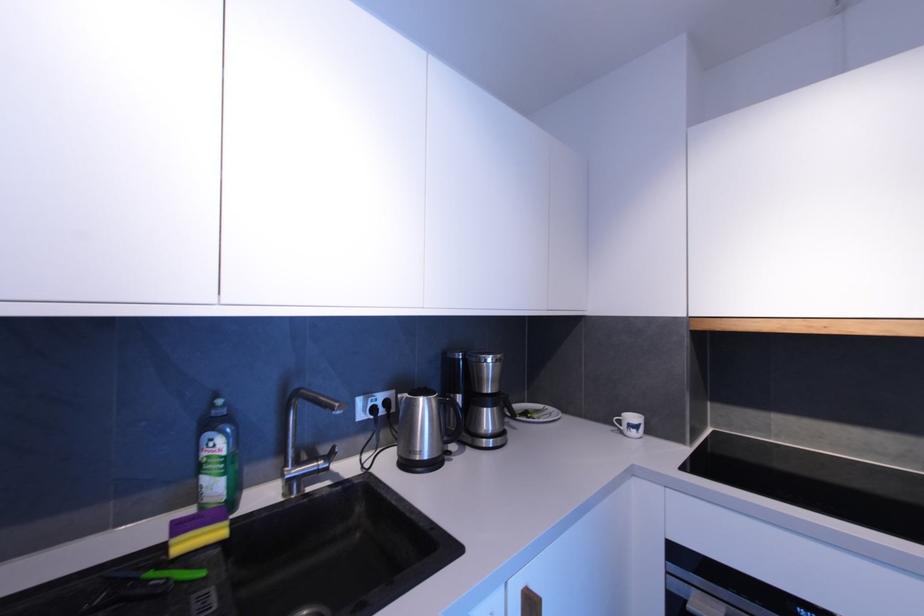
Where is `wooden cabinet handle`? The height and width of the screenshot is (616, 924). wooden cabinet handle is located at coordinates (529, 602).